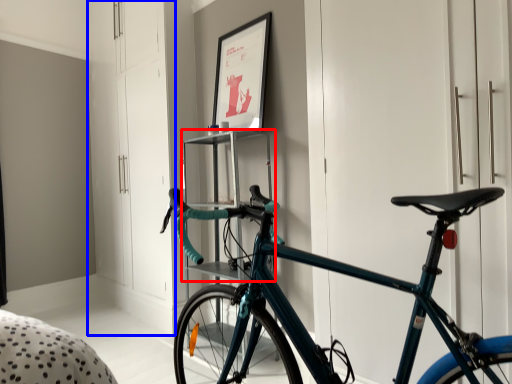
Question: Which object is closer to the camera taking this photo, shelf (highlighted by a red box) or dresser (highlighted by a blue box)?

Choices:
 (A) shelf
 (B) dresser

Answer: (A)